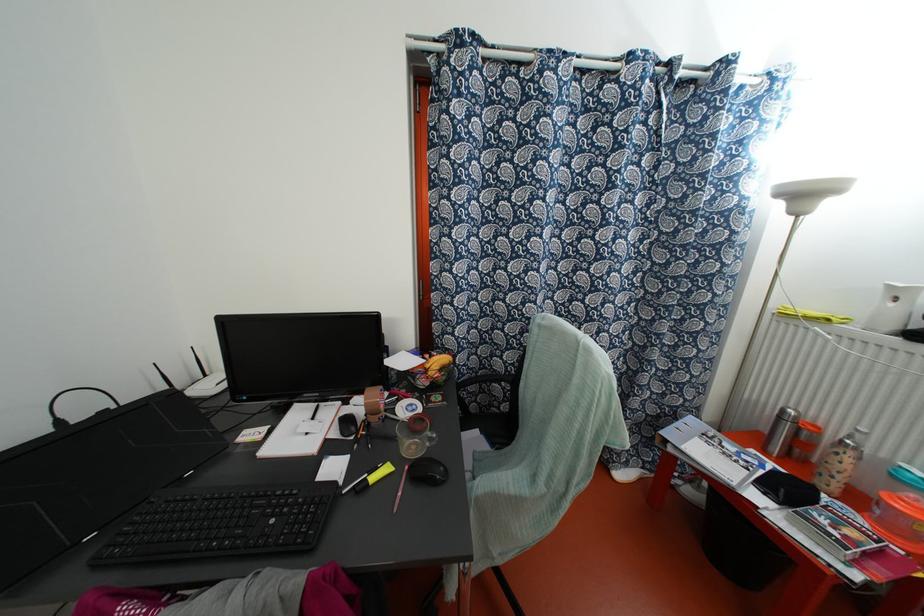
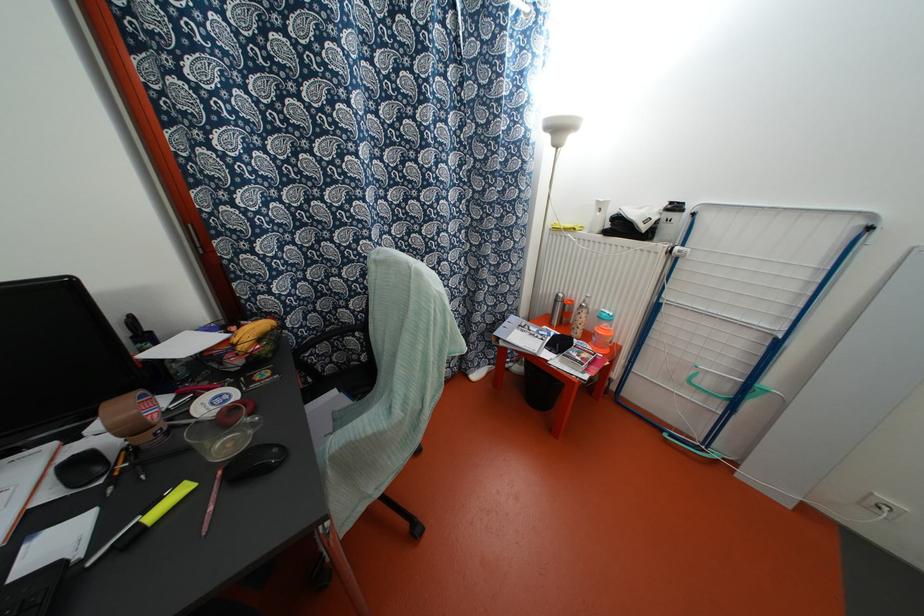
Where in the second image is the point corresponding to point 779,416 from the first image?

(554, 301)